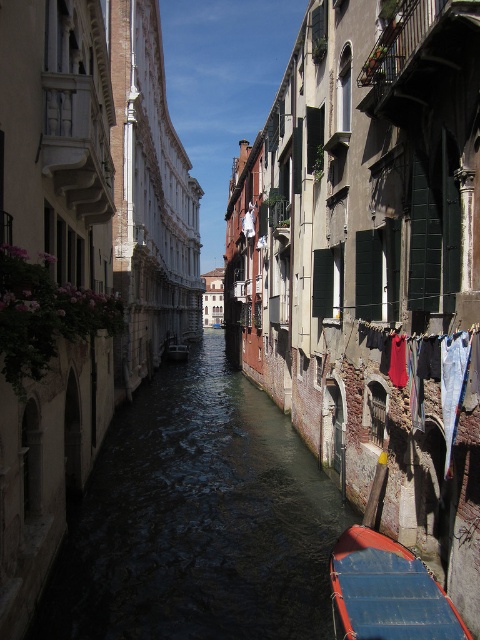
Question: Estimate the real-world distances between objects in this image. Which object is closer to the dark water at center?

Choices:
 (A) red fabric clothesline at right
 (B) orange fabric boat at lower center

Answer: (B)

Question: Which object is closer to the camera taking this photo?

Choices:
 (A) red fabric clothesline at right
 (B) dark water at center

Answer: (B)

Question: Estimate the real-world distances between objects in this image. Which object is closer to the orange fabric boat at lower center?

Choices:
 (A) dark water at center
 (B) red fabric clothesline at right

Answer: (B)

Question: Considering the relative positions of orange fabric boat at lower center and red fabric clothesline at right in the image provided, where is orange fabric boat at lower center located with respect to red fabric clothesline at right?

Choices:
 (A) left
 (B) right

Answer: (A)

Question: Does dark water at center have a smaller size compared to orange fabric boat at lower center?

Choices:
 (A) no
 (B) yes

Answer: (A)

Question: Is dark water at center above red fabric clothesline at right?

Choices:
 (A) no
 (B) yes

Answer: (A)